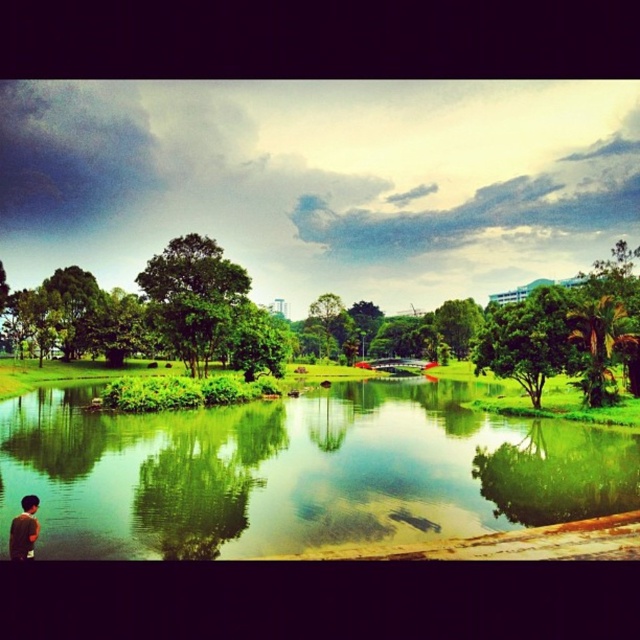
You are a photographer trying to capture the reflection of the green leafy tree at center and the green matte shirt at lower left in the water. Which object will have a bigger reflection in the water?

The green leafy tree at center has a larger size compared to the green matte shirt at lower left, so its reflection in the water will also be bigger.

You are planning to place a small boat in the park scene. The boat requires a water surface wider than the green leafy tree at left to fit. Based on the scene, can the green reflective water at lower left accommodate the boat?

The green reflective water at lower left might be wider than the green leafy tree at left, so it could potentially accommodate the boat if the water surface is indeed wider.

You are standing in the park and want to walk towards the point labeled as point (10, 540). If you walk straight ahead, will you first pass point (1, 291) before reaching your destination?

Point (10, 540) is in front of point (1, 291), so you will reach point (10, 540) before passing point (1, 291). Therefore, you will not pass point (1, 291) first.